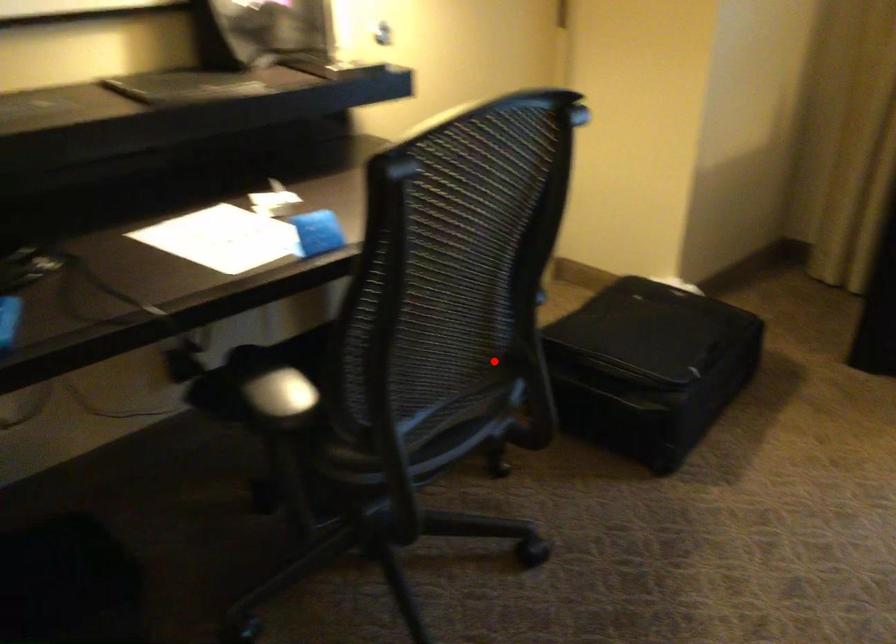
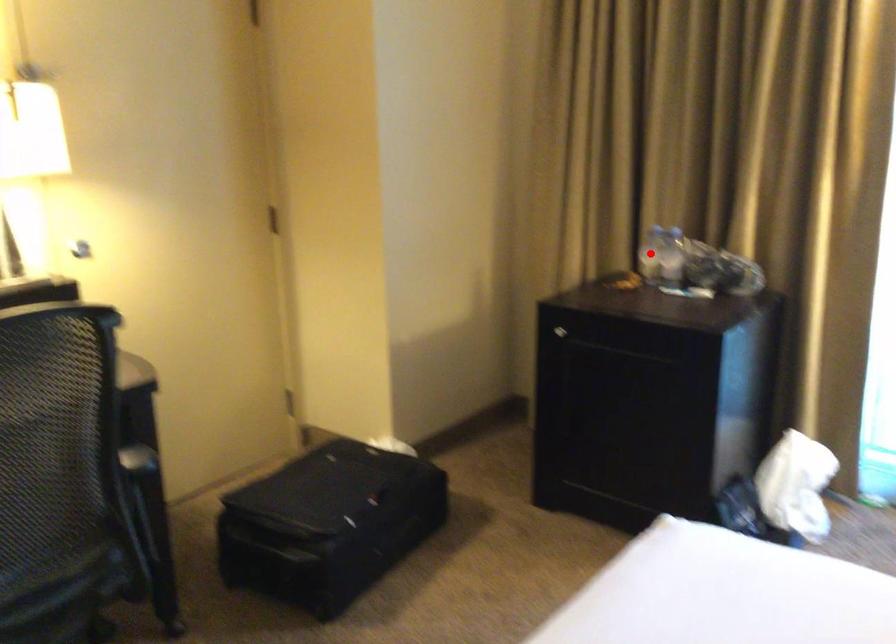
In the scene shown: I am providing you with two images of the same scene from different viewpoints. A red point is marked on the first image and another point is marked on the second image. Is the red point in image1 aligned with the point shown in image2?

No